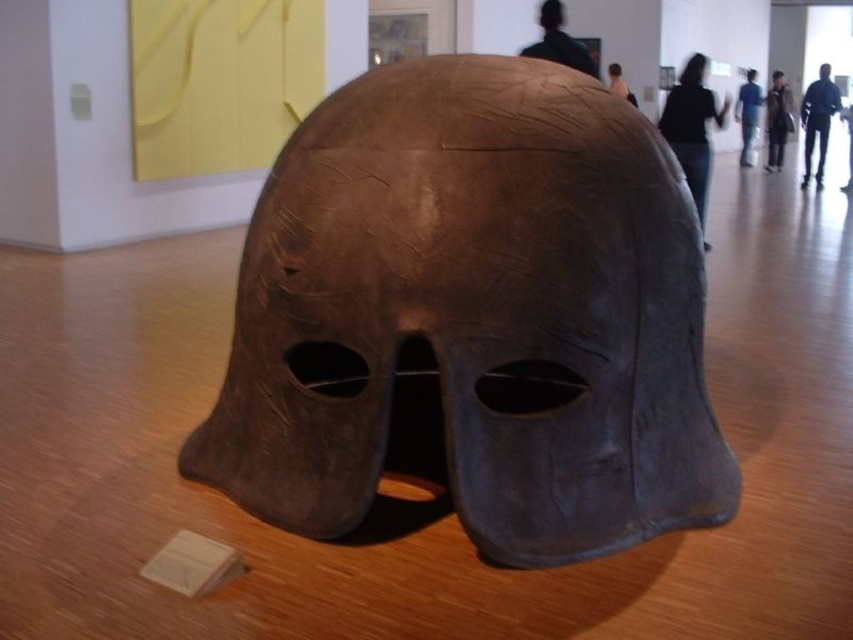
You are standing in an art gallery and see the black leather mask at upper center. If you want to take a closer look, how many steps do you think you need to take to reach it, assuming each step is about 0.75 meters?

The distance between you and the black leather mask at upper center is 4.44 meters. If each step is 0.75 meters, you would need approximately 6 steps to reach it.

You are an art student who wants to sketch the brown matte helmet at center and the blue jeans at center in the gallery. Since you have limited time, you need to know which object is shorter to prioritize drawing. Can you tell me which one is shorter?

The brown matte helmet at center is shorter than the blue jeans at center, so you should sketch the brown matte helmet at center first since it requires less time due to its smaller size.

You are an art student who wants to sketch the brown matte helmet at center and the brown leather jacket at upper right. Which object is located to the left of the other?

The brown matte helmet at center is positioned on the left side of brown leather jacket at upper right.